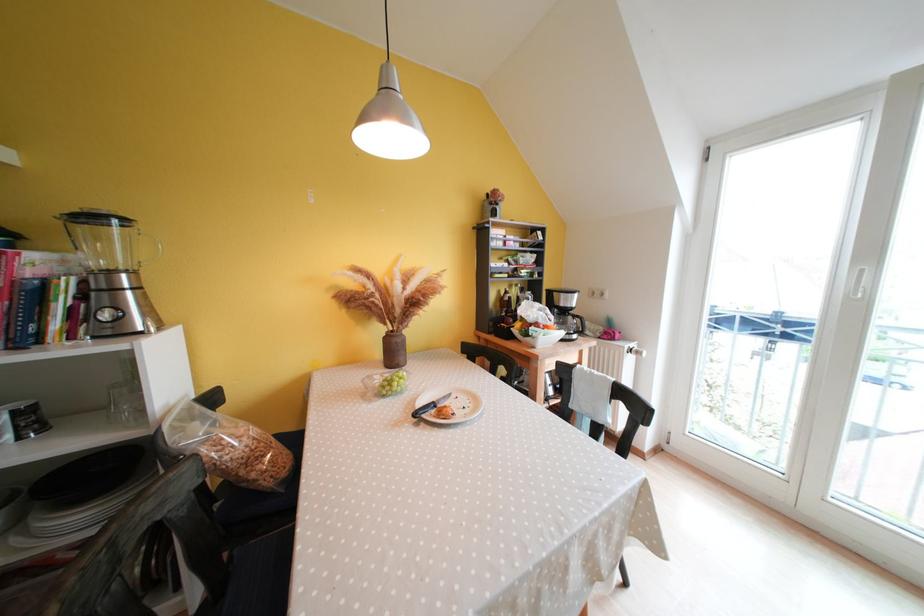
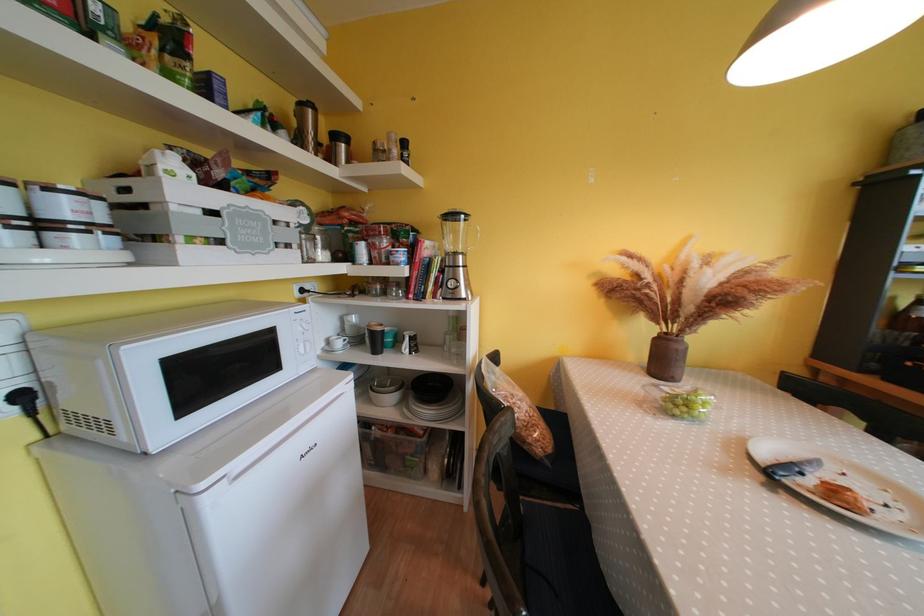
Locate, in the second image, the point that corresponds to pixel 445 403 in the first image.

(808, 467)